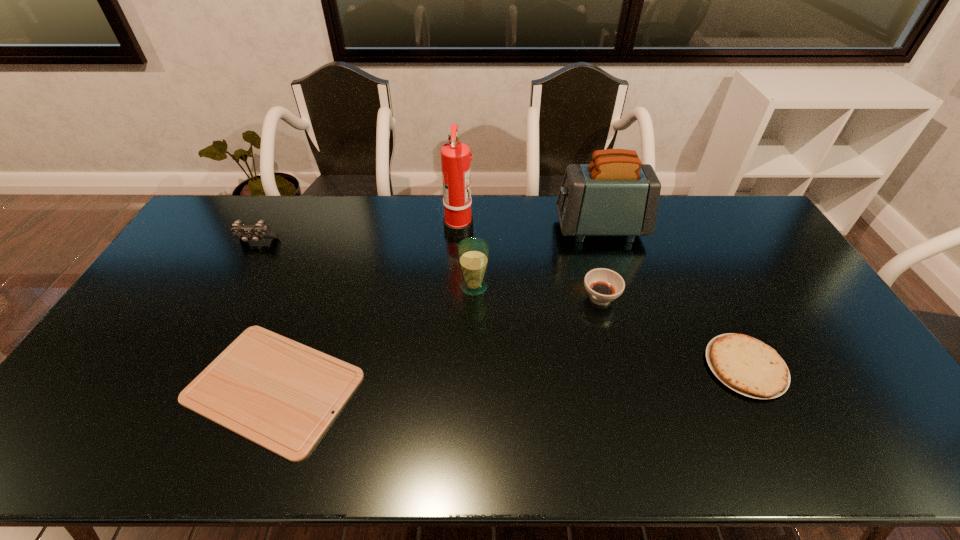
The height and width of the screenshot is (540, 960). Identify the location of vacant space located 0.250m on the front-facing side of the second tallest object. (487, 228).

Locate an element on the screen. This screenshot has width=960, height=540. blank area located 0.340m on the front-facing side of the second tallest object is located at coordinates (462, 228).

Find the location of a particular element. This screenshot has width=960, height=540. free space located 0.390m on the left of the glass is located at coordinates point(334,287).

This screenshot has width=960, height=540. In order to click on free space located 0.060m on the surface of the control with buttons in this screenshot , I will do `click(247, 260)`.

Find the location of a particular element. Image resolution: width=960 pixels, height=540 pixels. free space located 0.160m on the left of the soup bowl is located at coordinates (529, 298).

Locate an element on the screen. Image resolution: width=960 pixels, height=540 pixels. free space located 0.390m on the back of the tortilla is located at coordinates (684, 246).

This screenshot has height=540, width=960. Find the location of `free space located on the right of the chopping board`. free space located on the right of the chopping board is located at coordinates (424, 387).

You are a GUI agent. You are given a task and a screenshot of the screen. Output one action in this format:
    pyautogui.click(x=<x>, y=<y>)
    Task: Click on the fire extinguisher located at the far edge
    The width and height of the screenshot is (960, 540).
    Given the screenshot: What is the action you would take?
    pyautogui.click(x=455, y=156)

This screenshot has width=960, height=540. Find the location of `toaster positioned at the far edge`. toaster positioned at the far edge is located at coordinates (615, 195).

At what (x,y) coordinates should I click in order to perform the action: click on object present at the near edge. Please return your answer as a coordinate pair (x, y). This screenshot has height=540, width=960. Looking at the image, I should click on (278, 393).